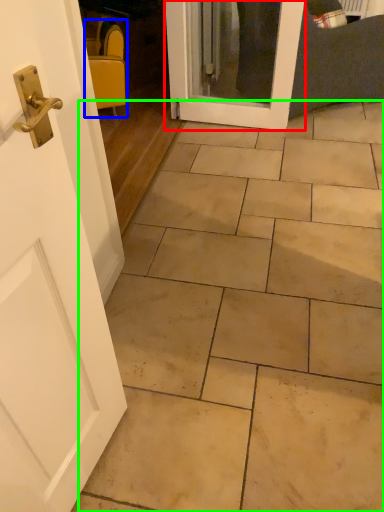
Question: Based on their relative distances, which object is nearer to door (highlighted by a red box)? Choose from chair (highlighted by a blue box) and ceramic tile (highlighted by a green box).

Choices:
 (A) chair
 (B) ceramic tile

Answer: (A)